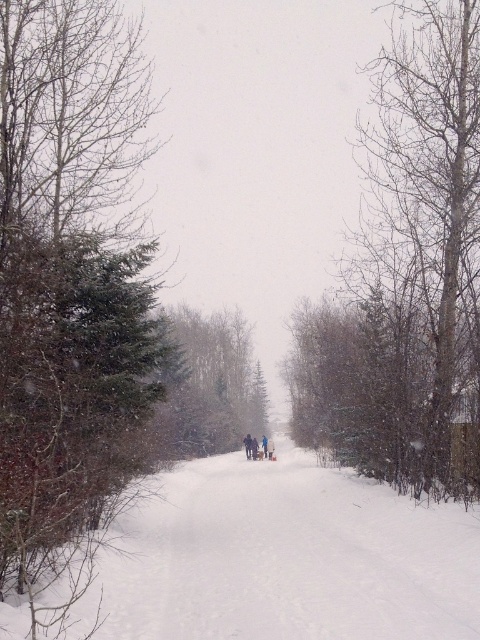
You are planning to build a small snowman in the winter scene. You need to collect snow from around the trees. Which tree would you choose to gather snow from, the bare wood tree at right or the green matte tree at center, and why?

The bare wood tree at right has a larger size compared to the green matte tree at center. Therefore, the bare wood tree at right would have more surface area for snow accumulation, making it a better choice for gathering snow.